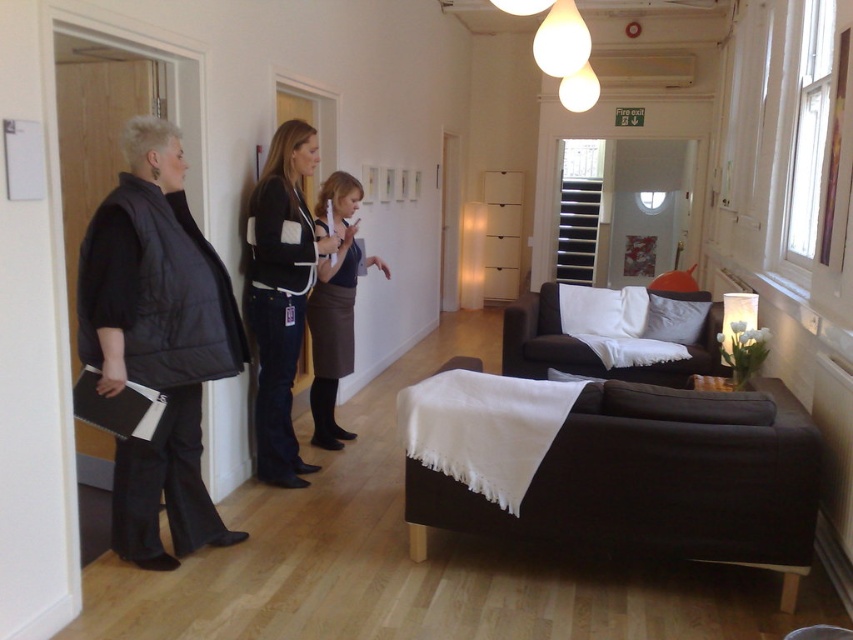
Is black denim jacket at center positioned before black fabric couch at center?

Yes, it is in front of black fabric couch at center.

Who is more forward, (294, 154) or (534, 362)?

Point (294, 154)

This screenshot has height=640, width=853. What do you see at coordinates (280, 294) in the screenshot? I see `black denim jacket at center` at bounding box center [280, 294].

Locate an element on the screen. The image size is (853, 640). black denim jacket at center is located at coordinates (280, 294).

Is point (178, 378) farther from camera compared to point (579, 371)?

No.

Does black puffer vest at left have a larger size compared to black fabric couch at center?

No.

What do you see at coordinates (157, 342) in the screenshot? I see `black puffer vest at left` at bounding box center [157, 342].

Identify the location of black puffer vest at left. (157, 342).

Does dark brown fabric couch at lower right appear on the right side of black puffer vest at left?

Yes, dark brown fabric couch at lower right is to the right of black puffer vest at left.

Is dark brown fabric couch at lower right to the left of black puffer vest at left from the viewer's perspective?

Incorrect, dark brown fabric couch at lower right is not on the left side of black puffer vest at left.

Does point (776, 515) come in front of point (129, 516)?

Yes.

The width and height of the screenshot is (853, 640). Identify the location of dark brown fabric couch at lower right. (654, 481).